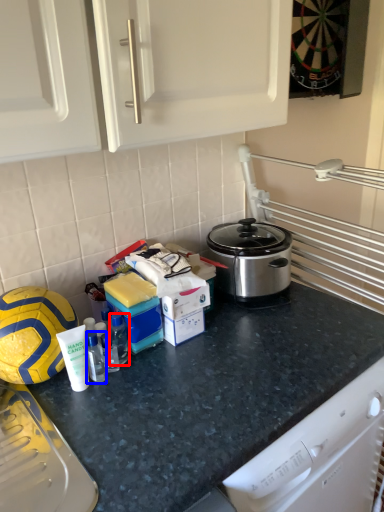
Question: Which object appears farthest to the camera in this image, bottle (highlighted by a red box) or bottle (highlighted by a blue box)?

Choices:
 (A) bottle
 (B) bottle

Answer: (A)